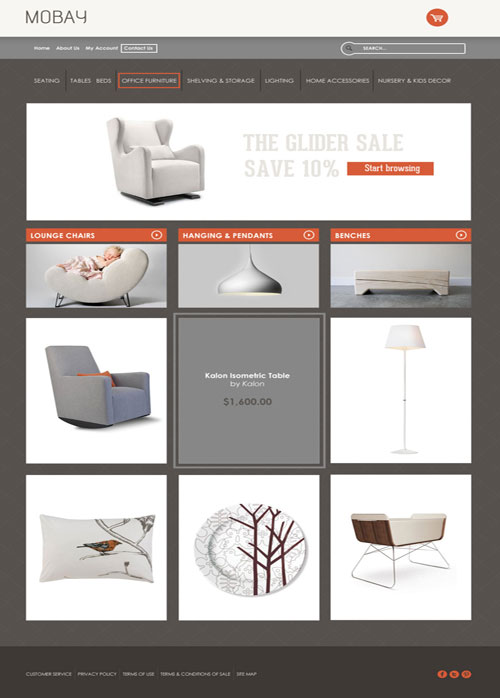
Identify the location of bench or ottoman. (411, 285).